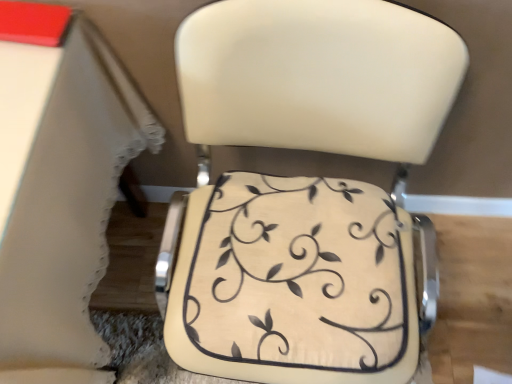
Locate an element on the screen. vacant point above beige fabric cushion at center (from a real-world perspective) is located at coordinates (301, 263).